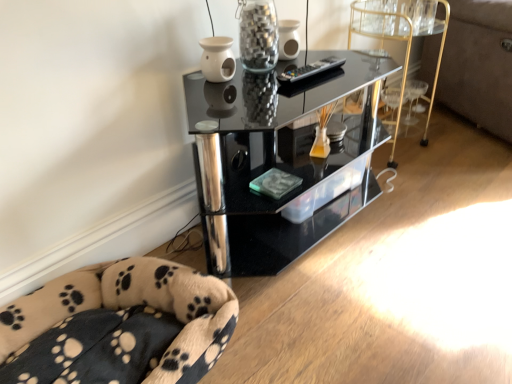
This screenshot has width=512, height=384. What do you see at coordinates (118, 326) in the screenshot? I see `fluffy beige dog bed at lower left` at bounding box center [118, 326].

What is the approximate width of transparent glass jar at upper center?

It is 15.04 centimeters.

What do you see at coordinates (258, 34) in the screenshot? The width and height of the screenshot is (512, 384). I see `transparent glass jar at upper center` at bounding box center [258, 34].

Where is `velvet beige couch at right`? The image size is (512, 384). velvet beige couch at right is located at coordinates (479, 64).

Would you say black glass shelf at center is a long distance from gold metallic bar cart at center right?

black glass shelf at center is actually quite close to gold metallic bar cart at center right.

From a real-world perspective, which is physically above, black glass shelf at center or gold metallic bar cart at center right?

From a 3D spatial view, gold metallic bar cart at center right is above.

Between black glass shelf at center and gold metallic bar cart at center right, which one appears on the left side from the viewer's perspective?

Positioned to the left is black glass shelf at center.

Which of these two, black glass shelf at center or gold metallic bar cart at center right, is bigger?

Bigger between the two is black glass shelf at center.

Which is more to the left, transparent glass jar at upper center or fluffy beige dog bed at lower left?

fluffy beige dog bed at lower left.

Who is smaller, transparent glass jar at upper center or fluffy beige dog bed at lower left?

transparent glass jar at upper center is smaller.

Are transparent glass jar at upper center and fluffy beige dog bed at lower left located far from each other?

No, transparent glass jar at upper center is not far away from fluffy beige dog bed at lower left.

Is transparent glass jar at upper center in front of fluffy beige dog bed at lower left?

No.

Between velvet beige couch at right and fluffy beige dog bed at lower left, which one is positioned behind?

velvet beige couch at right is further from the camera.

Is velvet beige couch at right positioned beyond the bounds of fluffy beige dog bed at lower left?

Yes.

Is fluffy beige dog bed at lower left at the back of velvet beige couch at right?

No, velvet beige couch at right is not facing the opposite direction of fluffy beige dog bed at lower left.

Considering the sizes of objects velvet beige couch at right and fluffy beige dog bed at lower left in the image provided, who is smaller, velvet beige couch at right or fluffy beige dog bed at lower left?

fluffy beige dog bed at lower left is smaller.

Considering the relative sizes of gold metallic bar cart at center right and transparent glass jar at upper center in the image provided, is gold metallic bar cart at center right taller than transparent glass jar at upper center?

Indeed, gold metallic bar cart at center right has a greater height compared to transparent glass jar at upper center.

Is point (394, 120) farther from viewer compared to point (249, 18)?

Yes, point (394, 120) is behind point (249, 18).

Is gold metallic bar cart at center right facing towards transparent glass jar at upper center?

No, gold metallic bar cart at center right is not oriented towards transparent glass jar at upper center.

Which of these two, gold metallic bar cart at center right or transparent glass jar at upper center, is smaller?

transparent glass jar at upper center.

Is gold metallic bar cart at center right placed right next to fluffy beige dog bed at lower left?

They are not placed beside each other.

Is gold metallic bar cart at center right to the right of fluffy beige dog bed at lower left from the viewer's perspective?

Indeed, gold metallic bar cart at center right is positioned on the right side of fluffy beige dog bed at lower left.

Is gold metallic bar cart at center right shorter than fluffy beige dog bed at lower left?

No, gold metallic bar cart at center right is not shorter than fluffy beige dog bed at lower left.

Between point (436, 70) and point (162, 373), which one is positioned behind?

The point (436, 70) is farther.

Does fluffy beige dog bed at lower left have a smaller size compared to gold metallic bar cart at center right?

Correct, fluffy beige dog bed at lower left occupies less space than gold metallic bar cart at center right.

In the image, is fluffy beige dog bed at lower left on the left side or the right side of gold metallic bar cart at center right?

Clearly, fluffy beige dog bed at lower left is on the left of gold metallic bar cart at center right in the image.

From a real-world perspective, which object rests below the other?

From a 3D spatial view, fluffy beige dog bed at lower left is below.

Can we say fluffy beige dog bed at lower left lies outside gold metallic bar cart at center right?

fluffy beige dog bed at lower left lies outside gold metallic bar cart at center right's area.

Considering the sizes of transparent glass jar at upper center and black glass shelf at center in the image, is transparent glass jar at upper center bigger or smaller than black glass shelf at center?

Clearly, transparent glass jar at upper center is smaller in size than black glass shelf at center.

The height and width of the screenshot is (384, 512). In the image, there is a transparent glass jar at upper center. In order to click on shelf below it (from a real-world perspective) in this screenshot , I will do `click(282, 160)`.

Can you confirm if transparent glass jar at upper center is thinner than black glass shelf at center?

Yes.

From the image's perspective, is transparent glass jar at upper center over black glass shelf at center?

Yes, from the image's perspective, transparent glass jar at upper center is over black glass shelf at center.

Locate an element on the screen. Image resolution: width=512 pixels, height=384 pixels. shelf located underneath the gold metallic bar cart at center right (from a real-world perspective) is located at coordinates (282, 160).

Identify the location of furniture in front of the transparent glass jar at upper center. (118, 326).

When comparing their distances from velvet beige couch at right, does transparent glass jar at upper center or fluffy beige dog bed at lower left seem closer?

Based on the image, transparent glass jar at upper center appears to be nearer to velvet beige couch at right.

Considering their positions, is fluffy beige dog bed at lower left positioned closer to black glass shelf at center than velvet beige couch at right?

Based on the image, fluffy beige dog bed at lower left appears to be nearer to black glass shelf at center.

When comparing their distances from velvet beige couch at right, does black glass shelf at center or fluffy beige dog bed at lower left seem closer?

black glass shelf at center.

Considering their positions, is velvet beige couch at right positioned closer to black glass shelf at center than gold metallic bar cart at center right?

The object closer to black glass shelf at center is gold metallic bar cart at center right.

Estimate the real-world distances between objects in this image. Which object is closer to gold metallic bar cart at center right, fluffy beige dog bed at lower left or black glass shelf at center?

black glass shelf at center is positioned closer to the anchor gold metallic bar cart at center right.

From the image, which object appears to be farther from transparent glass jar at upper center, velvet beige couch at right or gold metallic bar cart at center right?

velvet beige couch at right.

Which object lies further to the anchor point transparent glass jar at upper center, fluffy beige dog bed at lower left or velvet beige couch at right?

Among the two, velvet beige couch at right is located further to transparent glass jar at upper center.

From the image, which object appears to be farther from transparent glass jar at upper center, velvet beige couch at right or black glass shelf at center?

Among the two, velvet beige couch at right is located further to transparent glass jar at upper center.

This screenshot has height=384, width=512. I want to click on side table between transparent glass jar at upper center and fluffy beige dog bed at lower left in the vertical direction, so click(x=399, y=40).

Identify the location of shelf located between fluffy beige dog bed at lower left and velvet beige couch at right in the left-right direction. (282, 160).

Find the location of a particular element. This screenshot has height=384, width=512. shelf between transparent glass jar at upper center and velvet beige couch at right is located at coordinates (282, 160).

You are a GUI agent. You are given a task and a screenshot of the screen. Output one action in this format:
    pyautogui.click(x=<x>, y=<y>)
    Task: Click on the shelf between transparent glass jar at upper center and gold metallic bar cart at center right
    This screenshot has height=384, width=512.
    Given the screenshot: What is the action you would take?
    pyautogui.click(x=282, y=160)